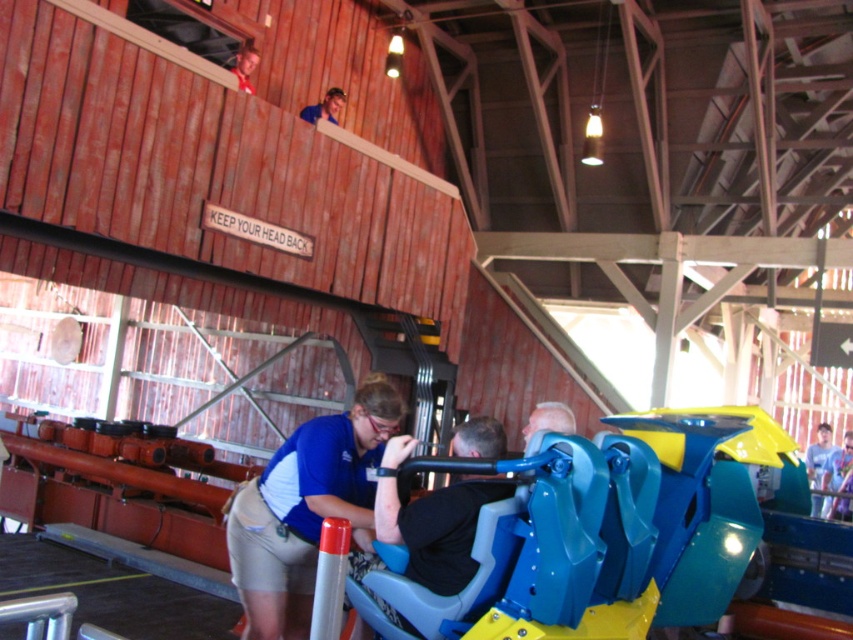
Between light blue shirt at center and blue shirt at upper center, which one has less height?

Standing shorter between the two is blue shirt at upper center.

Does light blue shirt at center appear on the left side of blue shirt at upper center?

Incorrect, light blue shirt at center is not on the left side of blue shirt at upper center.

Find the location of a particular element. The height and width of the screenshot is (640, 853). light blue shirt at center is located at coordinates (817, 452).

Is point (318, 420) positioned after point (813, 509)?

No, it is in front of (813, 509).

The height and width of the screenshot is (640, 853). In order to click on blue fabric shirt at center in this screenshot , I will do `click(306, 508)`.

Describe the element at coordinates (306, 508) in the screenshot. The height and width of the screenshot is (640, 853). I see `blue fabric shirt at center` at that location.

Which of these two, blue fabric shirt at center or blue shirt at upper center, stands shorter?

With less height is blue shirt at upper center.

Locate an element on the screen. Image resolution: width=853 pixels, height=640 pixels. blue fabric shirt at center is located at coordinates (306, 508).